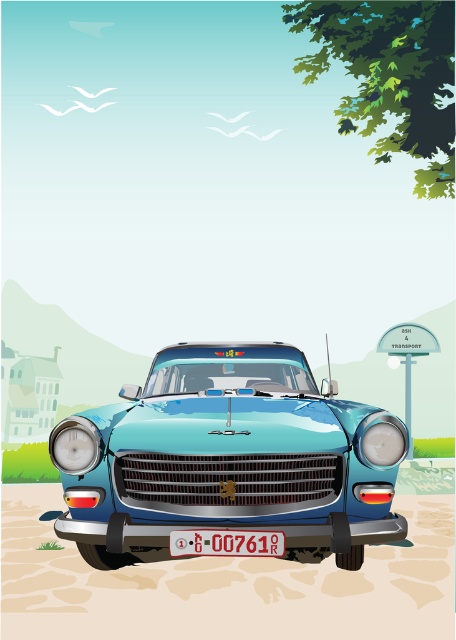
You are a photographer trying to capture the glossy metallic car at center and the white plastic license plate at center in a single shot. Since the car is bigger than the license plate, which object should you focus on first to ensure both are in frame?

The glossy metallic car at center is bigger than the white plastic license plate at center, so you should focus on the glossy metallic car at center first to ensure both are in frame.

You are a photographer aiming to capture the white plastic license plate at center and the green leafy tree at upper right in your shot. Which object will occupy more horizontal space in the photo?

The green leafy tree at upper right will occupy more horizontal space in the photo since its width surpasses that of the white plastic license plate at center.

You are standing in front of the vintage light blue car parked on cobblestones. There are two points marked on the car. The first point is at coordinates point (x=62, y=449) and the second at point (x=435, y=170). If you were to walk towards the car from the front, which point would you encounter first?

Point (x=62, y=449) is in front of point (x=435, y=170), so you would encounter point (x=62, y=449) first when approaching the car from the front.